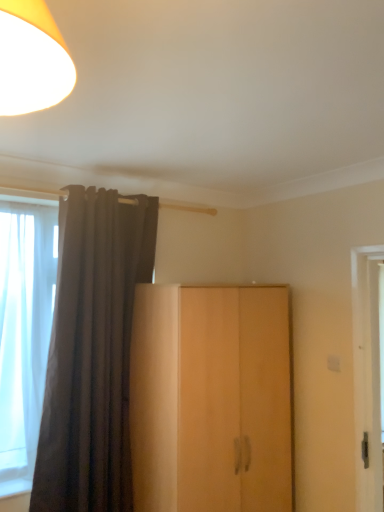
Question: From a real-world perspective, does light wood cupboard at center sit lower than dark grey velvet curtain at left?

Choices:
 (A) no
 (B) yes

Answer: (B)

Question: Does light wood cupboard at center lie behind dark grey velvet curtain at left?

Choices:
 (A) no
 (B) yes

Answer: (A)

Question: From the image's perspective, is light wood cupboard at center located beneath dark grey velvet curtain at left?

Choices:
 (A) no
 (B) yes

Answer: (B)

Question: From a real-world perspective, is light wood cupboard at center on dark grey velvet curtain at left?

Choices:
 (A) yes
 (B) no

Answer: (B)

Question: Does light wood cupboard at center have a lesser height compared to dark grey velvet curtain at left?

Choices:
 (A) no
 (B) yes

Answer: (B)

Question: Is light wood cupboard at center at the left side of dark grey velvet curtain at left?

Choices:
 (A) yes
 (B) no

Answer: (B)

Question: Does dark grey velvet curtain at left lie behind light wood cupboard at center?

Choices:
 (A) yes
 (B) no

Answer: (A)

Question: Considering the relative sizes of dark grey velvet curtain at left and light wood cupboard at center in the image provided, is dark grey velvet curtain at left bigger than light wood cupboard at center?

Choices:
 (A) yes
 (B) no

Answer: (B)

Question: Is dark grey velvet curtain at left beside light wood cupboard at center?

Choices:
 (A) no
 (B) yes

Answer: (A)

Question: Is dark grey velvet curtain at left to the right of light wood cupboard at center from the viewer's perspective?

Choices:
 (A) no
 (B) yes

Answer: (A)

Question: Is dark grey velvet curtain at left turned away from light wood cupboard at center?

Choices:
 (A) yes
 (B) no

Answer: (B)

Question: Is dark grey velvet curtain at left to the left of light wood cupboard at center from the viewer's perspective?

Choices:
 (A) yes
 (B) no

Answer: (A)

Question: Is point (122, 340) positioned closer to the camera than point (279, 317)?

Choices:
 (A) closer
 (B) farther

Answer: (A)